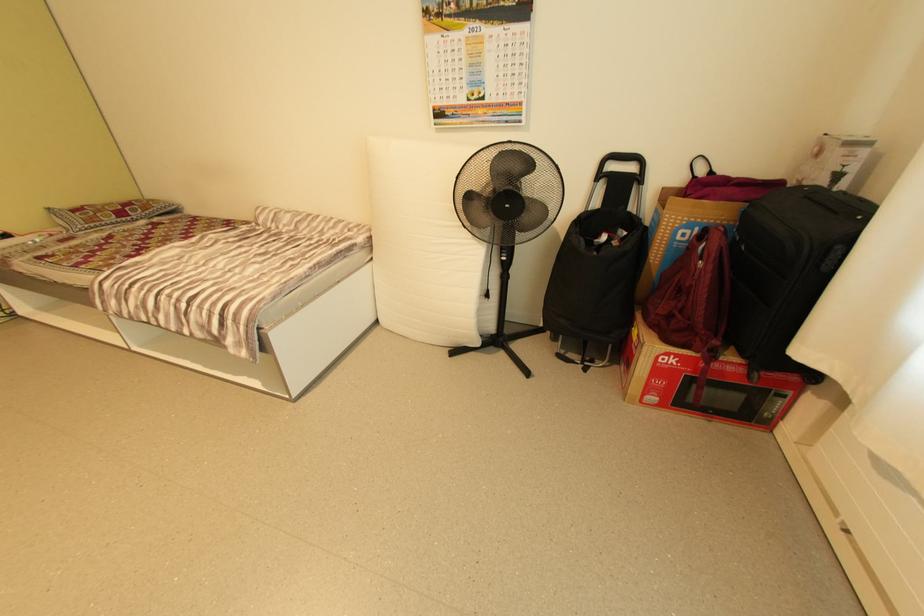
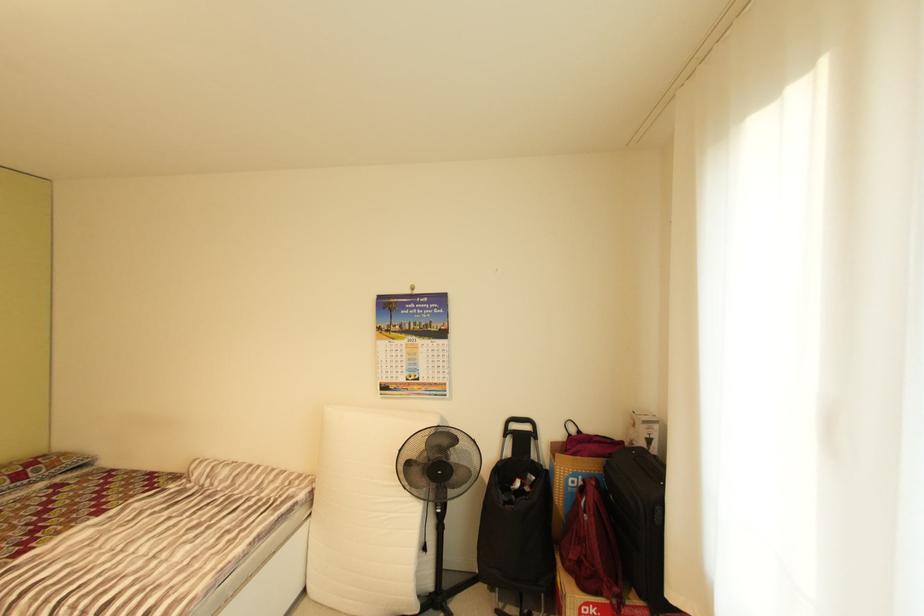
Question: How did the camera likely rotate?

Choices:
 (A) Left
 (B) Right
 (C) Up
 (D) Down

Answer: (C)